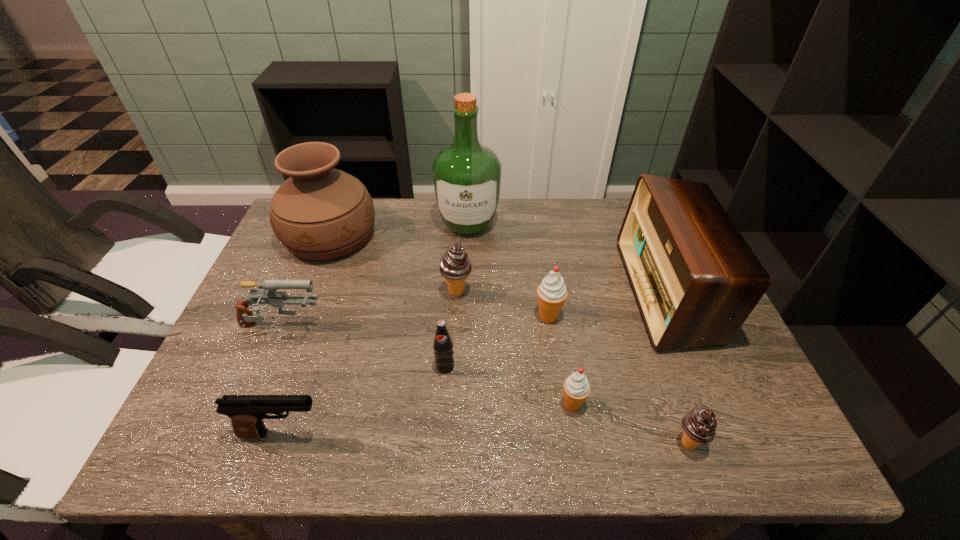
You are a GUI agent. You are given a task and a screenshot of the screen. Output one action in this format:
    pyautogui.click(x=<x>, y=<y>)
    Task: Click on the gun
    Image resolution: width=960 pixels, height=540 pixels.
    Given the screenshot: What is the action you would take?
    pyautogui.click(x=267, y=291)

Find the location of a particular element. This screenshot has width=960, height=540. black pistol is located at coordinates (247, 412).

The image size is (960, 540). I want to click on the eighth farthest object, so click(576, 387).

You are a GUI agent. You are given a task and a screenshot of the screen. Output one action in this format:
    pyautogui.click(x=<x>, y=<y>)
    Task: Click on the second nearest icecream
    The height and width of the screenshot is (540, 960).
    Given the screenshot: What is the action you would take?
    pyautogui.click(x=576, y=387)

You are a GUI agent. You are given a task and a screenshot of the screen. Output one action in this format:
    pyautogui.click(x=<x>, y=<y>)
    Task: Click on the nearer chocolate icecream
    
    Given the screenshot: What is the action you would take?
    pyautogui.click(x=699, y=425)

Find the location of a particular element. the smaller chocolate icecream is located at coordinates (699, 425).

You are a GUI agent. You are given a task and a screenshot of the screen. Output one action in this format:
    pyautogui.click(x=<x>, y=<y>)
    Task: Click on the free location located 0.170m on the front-facing side of the liquor
    Image resolution: width=960 pixels, height=540 pixels.
    Given the screenshot: What is the action you would take?
    pyautogui.click(x=467, y=285)

Locate an element on the screen. free location located on the right of the urn is located at coordinates (415, 237).

Identify the location of vacant space situated on the front-facing side of the radio receiver. Image resolution: width=960 pixels, height=540 pixels. (594, 292).

Locate an element on the screen. The image size is (960, 540). vacant space located 0.260m on the front-facing side of the radio receiver is located at coordinates (533, 292).